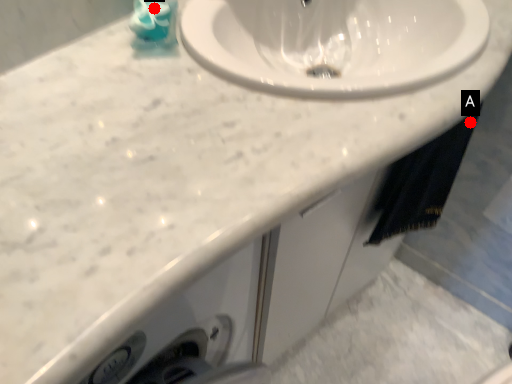
Question: Two points are circled on the image, labeled by A and B beside each circle. Among these points, which one is farthest from the camera?

Choices:
 (A) A is further
 (B) B is further

Answer: (A)